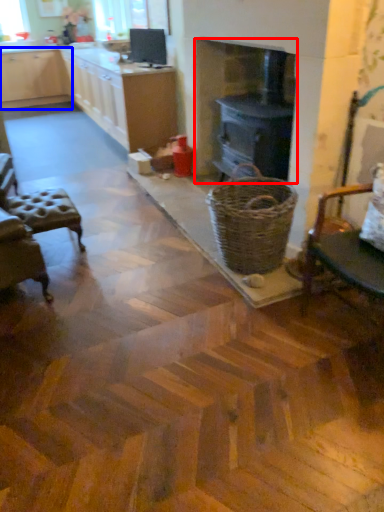
Question: Which of the following is the farthest to the observer, fireplace (highlighted by a red box) or cabinetry (highlighted by a blue box)?

Choices:
 (A) fireplace
 (B) cabinetry

Answer: (B)